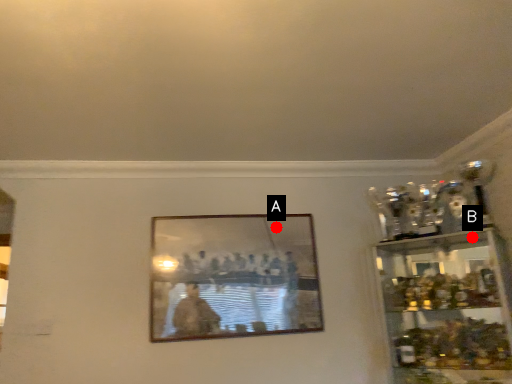
Question: Two points are circled on the image, labeled by A and B beside each circle. Among these points, which one is farthest from the camera?

Choices:
 (A) A is further
 (B) B is further

Answer: (A)